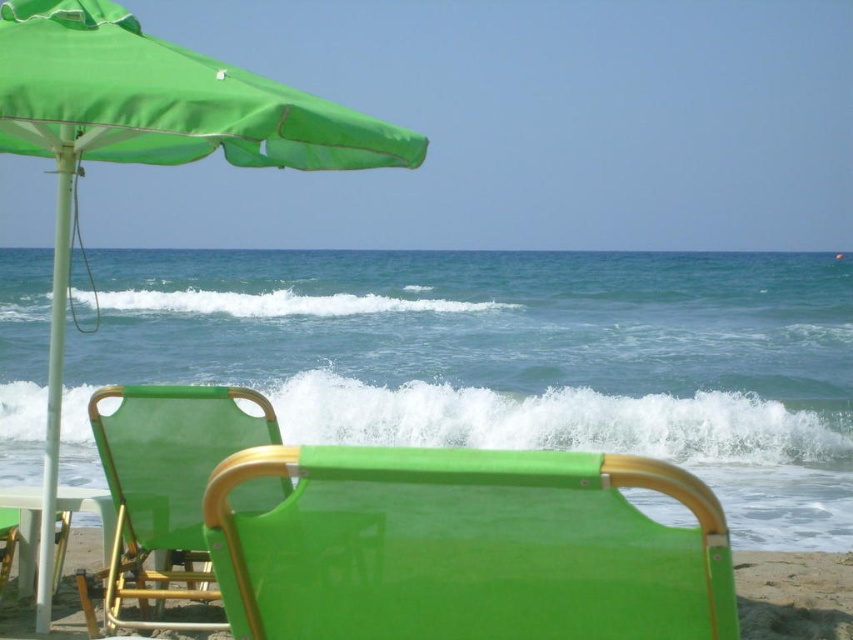
This screenshot has height=640, width=853. What do you see at coordinates (149, 136) in the screenshot? I see `green fabric umbrella at upper left` at bounding box center [149, 136].

Can you confirm if green fabric umbrella at upper left is positioned to the left of matte green fabric beach chair at lower left?

Correct, you'll find green fabric umbrella at upper left to the left of matte green fabric beach chair at lower left.

Is point (270, 164) in front of point (189, 506)?

No, it is behind (189, 506).

The height and width of the screenshot is (640, 853). What are the coordinates of `green fabric umbrella at upper left` in the screenshot? It's located at (149, 136).

Does green fabric beach chair at center have a greater width compared to green fabric umbrella at upper left?

No.

Who is positioned more to the right, green fabric beach chair at center or green fabric umbrella at upper left?

From the viewer's perspective, green fabric beach chair at center appears more on the right side.

What do you see at coordinates (466, 547) in the screenshot? The width and height of the screenshot is (853, 640). I see `green fabric beach chair at center` at bounding box center [466, 547].

You are a GUI agent. You are given a task and a screenshot of the screen. Output one action in this format:
    pyautogui.click(x=<x>, y=<y>)
    Task: Click on the green fabric beach chair at center
    This screenshot has height=640, width=853.
    Given the screenshot: What is the action you would take?
    pyautogui.click(x=466, y=547)

In the scene shown: Is green fabric beach chair at center closer to camera compared to matte green fabric beach chair at lower left?

Yes, it is in front of matte green fabric beach chair at lower left.

Based on the photo, between green fabric beach chair at center and matte green fabric beach chair at lower left, which one is positioned higher?

green fabric beach chair at center is higher up.

Find the location of `green fabric beach chair at center`. green fabric beach chair at center is located at coordinates (466, 547).